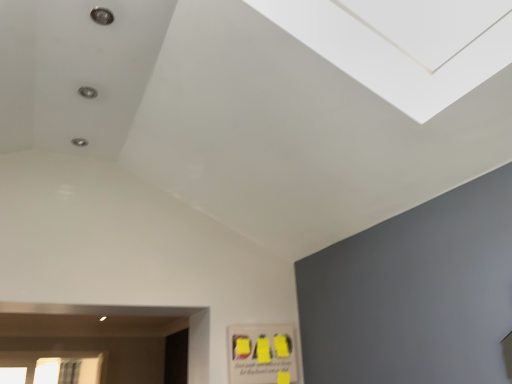
Question: Is white glass window at lower left spatially inside yellow matte poster at lower right, or outside of it?

Choices:
 (A) outside
 (B) inside

Answer: (A)

Question: From a real-world perspective, is white glass window at lower left physically located above or below yellow matte poster at lower right?

Choices:
 (A) below
 (B) above

Answer: (B)

Question: Visually, is white glass window at lower left positioned to the left or to the right of yellow matte poster at lower right?

Choices:
 (A) right
 (B) left

Answer: (B)

Question: Looking at their shapes, would you say yellow matte poster at lower right is wider or thinner than white glass window at lower left?

Choices:
 (A) wide
 (B) thin

Answer: (B)

Question: From a real-world perspective, is yellow matte poster at lower right physically located above or below white glass window at lower left?

Choices:
 (A) below
 (B) above

Answer: (A)

Question: From their relative heights in the image, would you say yellow matte poster at lower right is taller or shorter than white glass window at lower left?

Choices:
 (A) tall
 (B) short

Answer: (B)

Question: In terms of size, does yellow matte poster at lower right appear bigger or smaller than white glass window at lower left?

Choices:
 (A) small
 (B) big

Answer: (A)